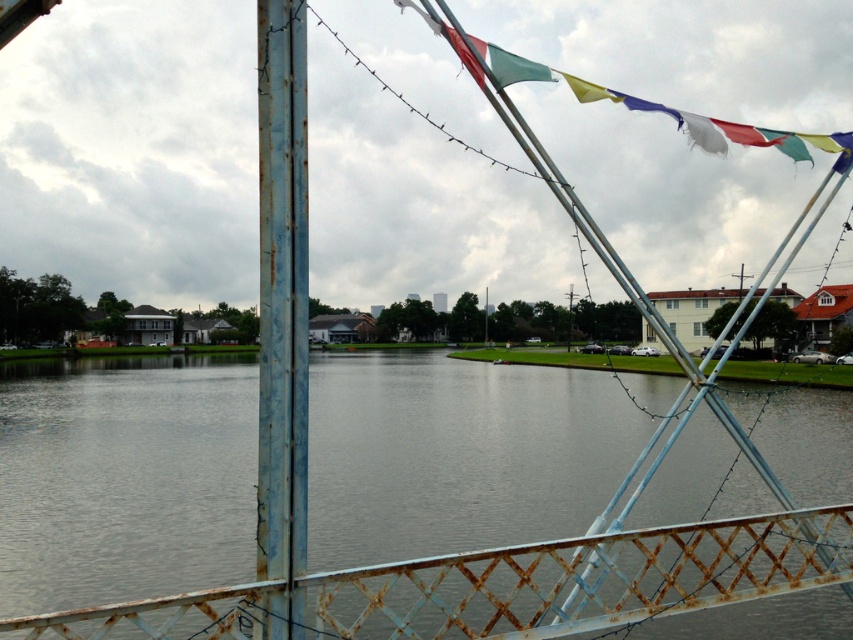
Question: Where is gray metallic water at center located in relation to rusty metal pole at left in the image?

Choices:
 (A) right
 (B) left

Answer: (B)

Question: Considering the relative positions of gray metallic water at center and rusty metal flag at upper right in the image provided, where is gray metallic water at center located with respect to rusty metal flag at upper right?

Choices:
 (A) right
 (B) left

Answer: (B)

Question: Which of these objects is positioned farthest from the rusty metal flag at upper right?

Choices:
 (A) gray metallic water at center
 (B) rusty metal pole at left

Answer: (A)

Question: Considering the real-world distances, which object is farthest from the rusty metal pole at left?

Choices:
 (A) rusty metal flag at upper right
 (B) gray metallic water at center

Answer: (B)

Question: Where is gray metallic water at center located in relation to rusty metal flag at upper right in the image?

Choices:
 (A) below
 (B) above

Answer: (A)

Question: Which of these objects is positioned closest to the rusty metal pole at left?

Choices:
 (A) rusty metal flag at upper right
 (B) gray metallic water at center

Answer: (A)